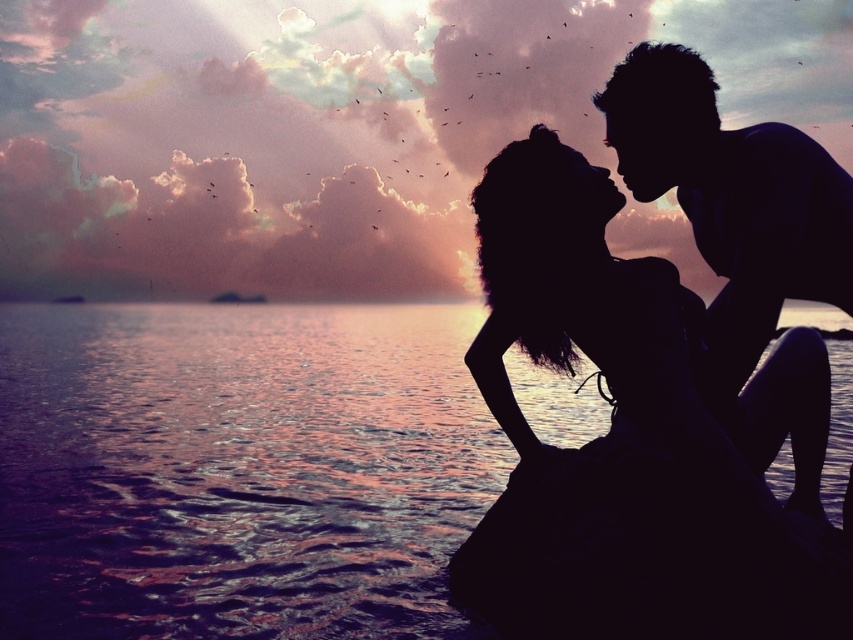
Question: Which point appears closest to the camera in this image?

Choices:
 (A) (715, 324)
 (B) (57, 381)
 (C) (520, 147)

Answer: (C)

Question: Which point is farther to the camera?

Choices:
 (A) silhouette man at upper right
 (B) reflective blue water at lower left
 (C) black matte dress at center

Answer: (B)

Question: Observing the image, what is the correct spatial positioning of black matte dress at center in reference to silhouette man at upper right?

Choices:
 (A) left
 (B) right

Answer: (A)

Question: Does reflective blue water at lower left appear over black matte dress at center?

Choices:
 (A) no
 (B) yes

Answer: (B)

Question: Which point is farther from the camera taking this photo?

Choices:
 (A) (490, 282)
 (B) (643, 99)

Answer: (A)

Question: Can you confirm if reflective blue water at lower left is positioned to the left of black matte dress at center?

Choices:
 (A) yes
 (B) no

Answer: (B)